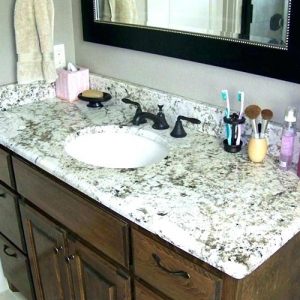
You are a GUI agent. You are given a task and a screenshot of the screen. Output one action in this format:
    pyautogui.click(x=<x>, y=<y>)
    Task: Click on the faux marble
    
    Given the screenshot: What is the action you would take?
    pyautogui.click(x=46, y=116), pyautogui.click(x=28, y=88), pyautogui.click(x=164, y=99), pyautogui.click(x=247, y=213)